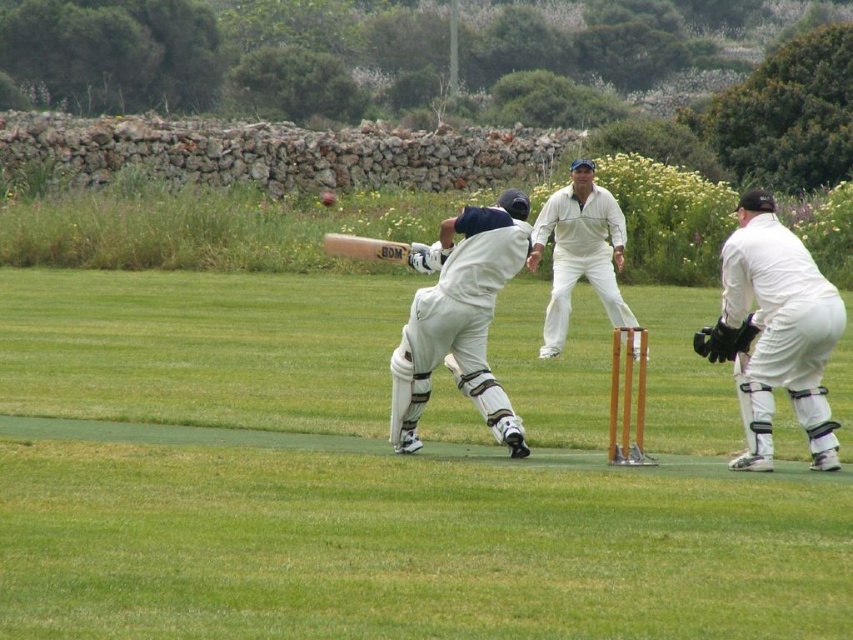
Looking at this image, is the position of white matte cricket gear at right less distant than that of white cloth cricket bat at center?

Yes, it is.

Who is higher up, white matte cricket gear at right or white cloth cricket bat at center?

white cloth cricket bat at center is above.

This screenshot has height=640, width=853. What do you see at coordinates (775, 332) in the screenshot?
I see `white matte cricket gear at right` at bounding box center [775, 332].

I want to click on white matte cricket gear at right, so click(775, 332).

Measure the distance between white matte cricket gear at right and wooden bat at center.

white matte cricket gear at right and wooden bat at center are 3.64 meters apart.

Which is more to the right, white matte cricket gear at right or wooden bat at center?

Positioned to the right is white matte cricket gear at right.

Does point (805, 257) lie behind point (355, 253)?

No.

Where is `white matte cricket gear at right`? This screenshot has height=640, width=853. white matte cricket gear at right is located at coordinates (775, 332).

Can you confirm if white matte cricket gear at right is wider than white matte cricket bat at center?

No.

Identify the location of white matte cricket gear at right. (775, 332).

This screenshot has width=853, height=640. What are the coordinates of `white matte cricket gear at right` in the screenshot? It's located at (775, 332).